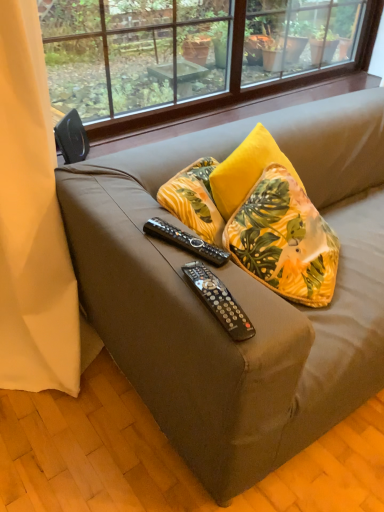
Identify the location of vacant space to the left of black plastic remote at center, which is the 2th remote control in back-to-front order. (172, 284).